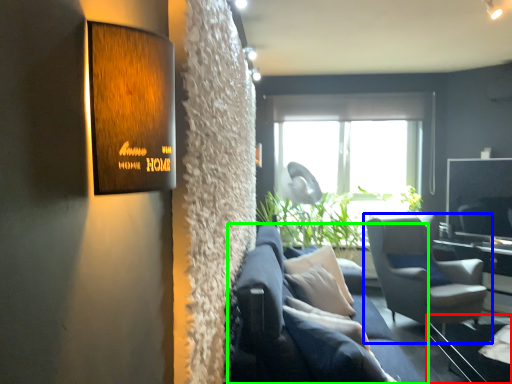
Question: Which is farther away from glass table (highlighted by a red box)? chair (highlighted by a blue box) or studio couch (highlighted by a green box)?

Choices:
 (A) chair
 (B) studio couch

Answer: (B)